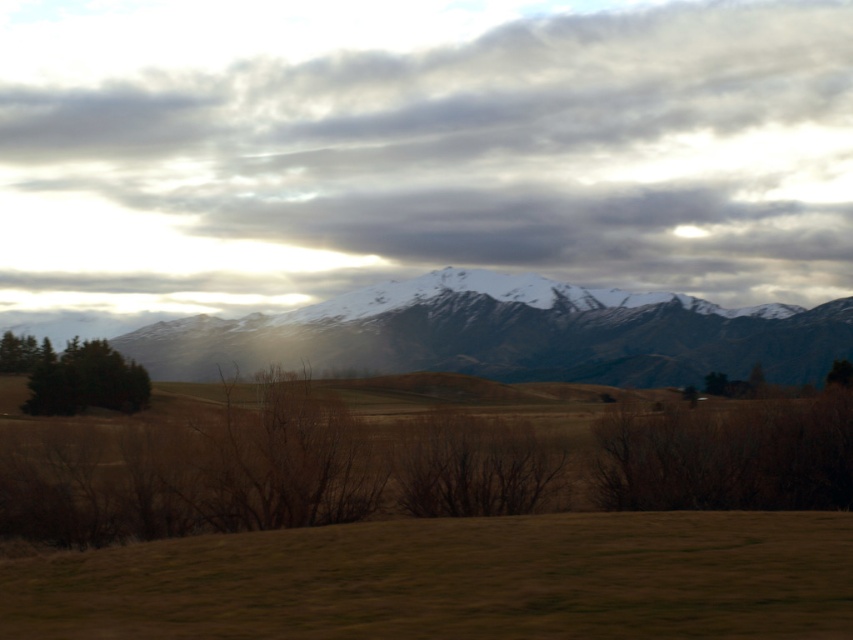
You are standing at the origin point of the coordinate system in the image. You want to walk towards the brown grass at lower center. What coordinates should you aim for?

You should aim for the coordinates point at (456, 579) to reach the brown grass at lower center.

You are standing in the middle of the field looking towards the mountains. You notice the brown grass at lower center and the green matte tree at lower left. Which object is nearer to you?

The brown grass at lower center is closer to the viewer than the green matte tree at lower left.